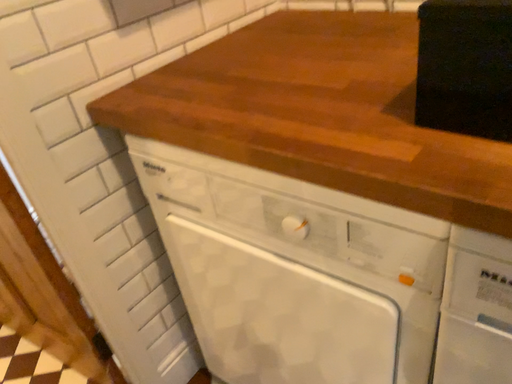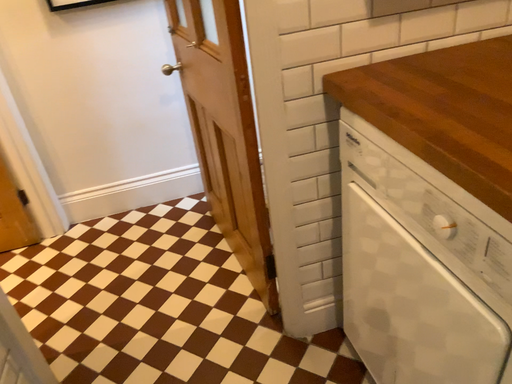
Question: How did the camera likely rotate when shooting the video?

Choices:
 (A) rotated right
 (B) rotated left

Answer: (B)